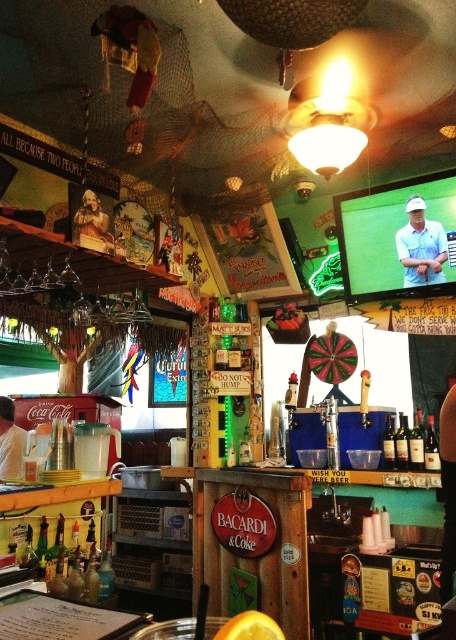
Consider the image. You are a customer at the bar and want to order a drink. You see the matte blue shirt at center and the smooth wooden table at center. Which object is closer to your left side?

The smooth wooden table at center is closer to your left side because the matte blue shirt at center is to the right of it.